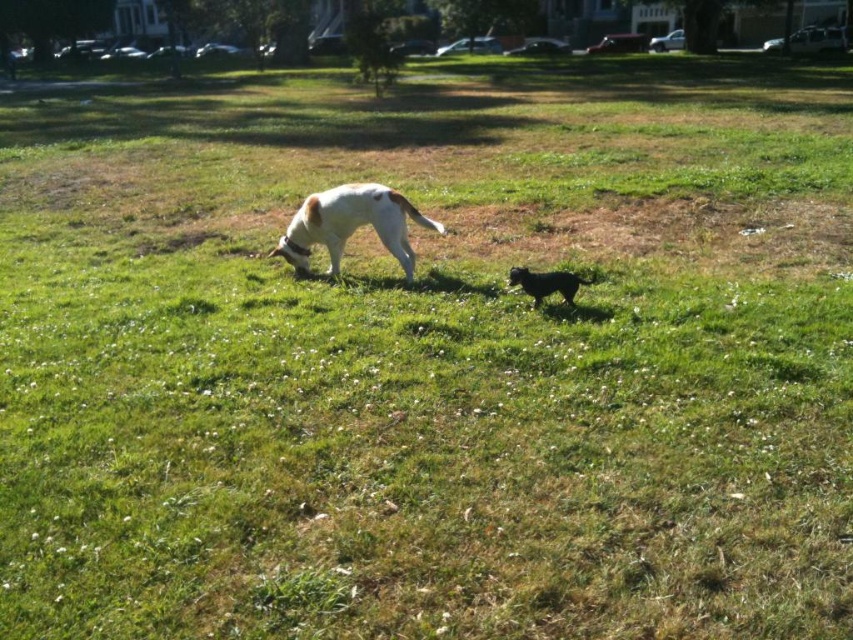
You are standing at the camera position and want to throw a ball to the white matte dog at center. If the ball travels in a straight line, will it pass over any obstacles like trees or bushes between you and the dog?

The scene description mentions a grassy park with scattered small white flowers and no trees or bushes mentioned between you and the white matte dog at center. Since there are no obstacles listed, the ball will travel in a straight line without obstruction.

You are a photographer trying to capture both the white matte dog at center and the shiny black dog at center in a single shot. Which dog should you focus on first to ensure both are in clear focus?

You should focus on the white matte dog at center first because it is closer to you than the shiny black dog at center, ensuring both will be in focus when using depth of field properly.

You are a dog owner who wants to ensure both dogs have enough space to move comfortably. Given that the white matte dog at center is larger than the shiny black dog at center, which dog requires more space to move around?

The white matte dog at center requires more space to move around since it is larger in size compared to the shiny black dog at center.